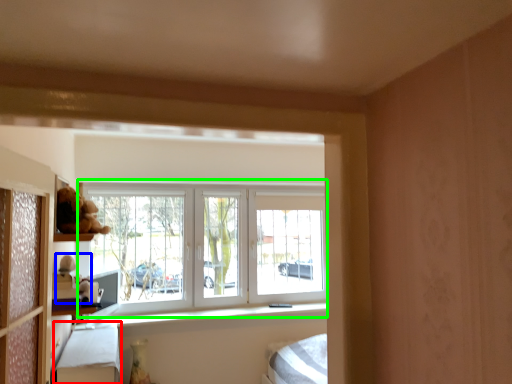
Question: Which object is the farthest from bed frame (highlighted by a red box)? Choose among these: toy (highlighted by a blue box) or window (highlighted by a green box).

Choices:
 (A) toy
 (B) window

Answer: (B)